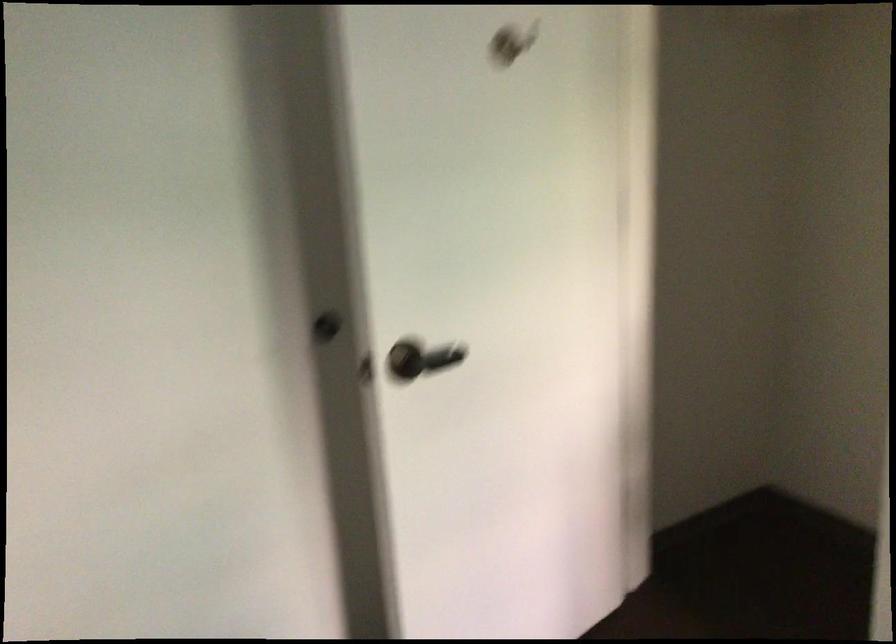
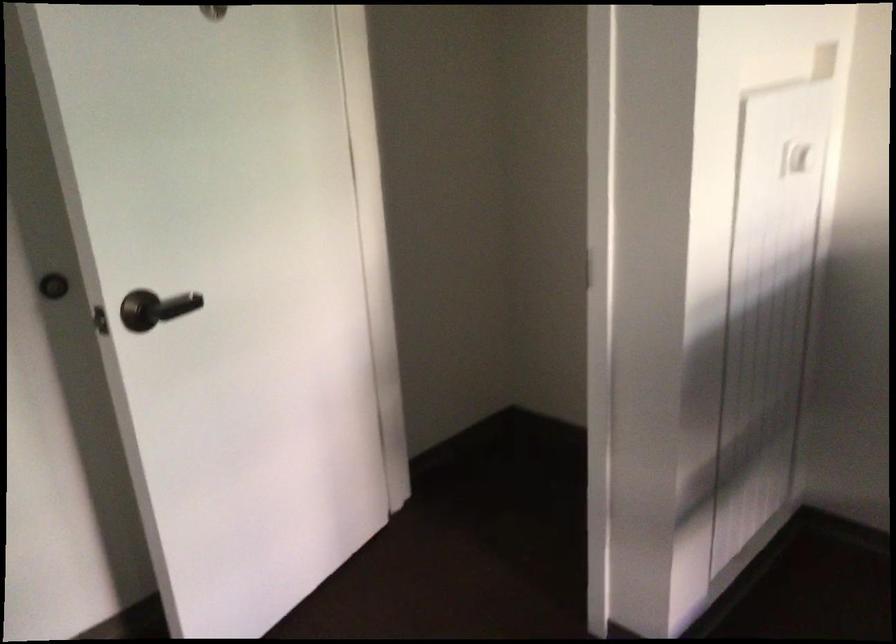
Question: The first image is from the beginning of the video and the second image is from the end. How did the camera likely rotate when shooting the video?

Choices:
 (A) Left
 (B) Right
 (C) Up
 (D) Down

Answer: (B)